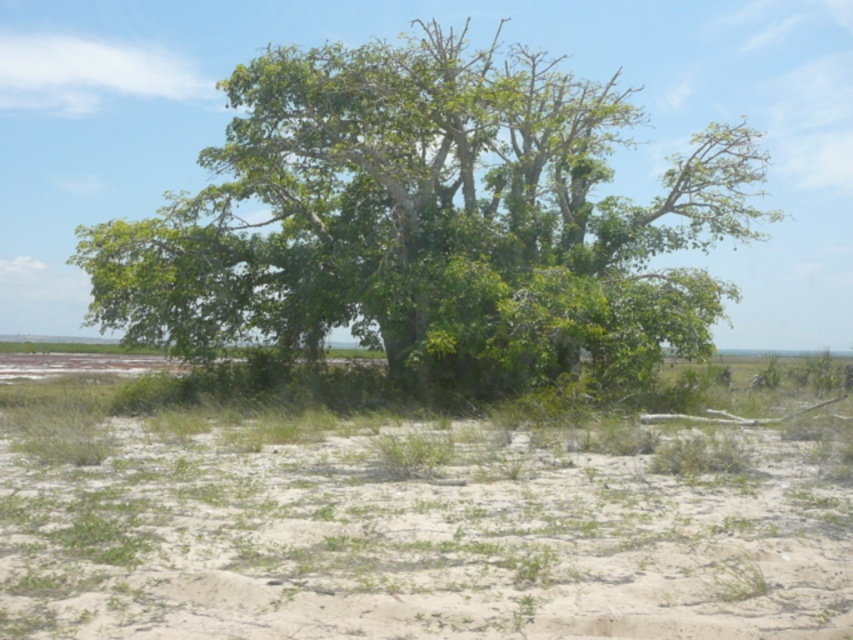
Question: Which point is farther to the camera?

Choices:
 (A) (354, 449)
 (B) (236, 138)

Answer: (B)

Question: Is green leafy tree at center behind white sandy soil at lower center?

Choices:
 (A) yes
 (B) no

Answer: (A)

Question: Can you confirm if green leafy tree at center is positioned to the right of white sandy soil at lower center?

Choices:
 (A) no
 (B) yes

Answer: (A)

Question: Where is green leafy tree at center located in relation to white sandy soil at lower center in the image?

Choices:
 (A) left
 (B) right

Answer: (A)

Question: Which of the following is the farthest from the observer?

Choices:
 (A) white sandy soil at lower center
 (B) green leafy tree at center

Answer: (B)